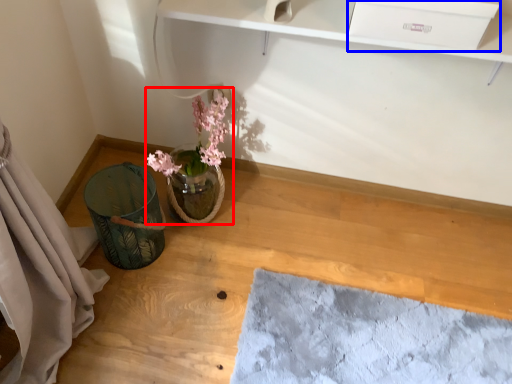
Question: Among these objects, which one is farthest to the camera, floral arrangement (highlighted by a red box) or drawer (highlighted by a blue box)?

Choices:
 (A) floral arrangement
 (B) drawer

Answer: (A)